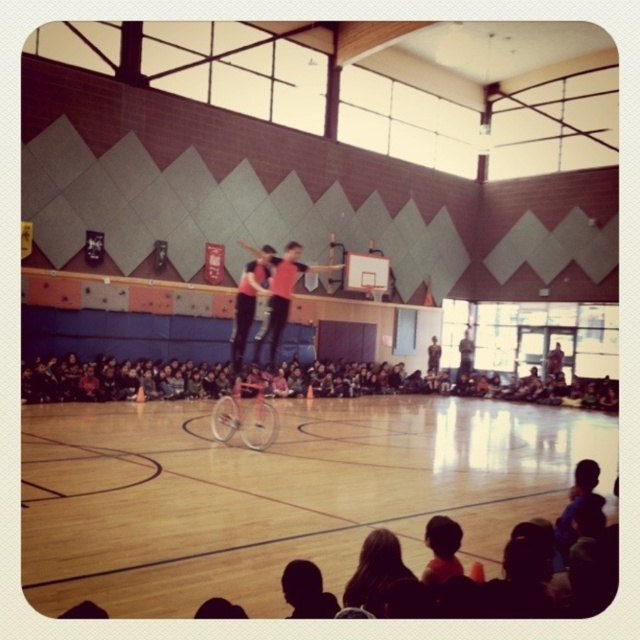
Question: Is pink matte bicycle at center positioned before matte pink bicycle at center?

Choices:
 (A) yes
 (B) no

Answer: (B)

Question: Is wooden basketball court at center wider than matte pink bicycle at center?

Choices:
 (A) no
 (B) yes

Answer: (B)

Question: Is wooden basketball court at center positioned at the back of matte pink bicycle at center?

Choices:
 (A) yes
 (B) no

Answer: (B)

Question: Which object appears farthest from the camera in this image?

Choices:
 (A) matte pink bicycle at center
 (B) pink matte bicycle at center

Answer: (B)

Question: Among these objects, which one is nearest to the camera?

Choices:
 (A) matte pink bicycle at center
 (B) wooden basketball court at center

Answer: (B)

Question: Among these points, which one is nearest to the camera?

Choices:
 (A) (285, 308)
 (B) (234, 396)

Answer: (A)